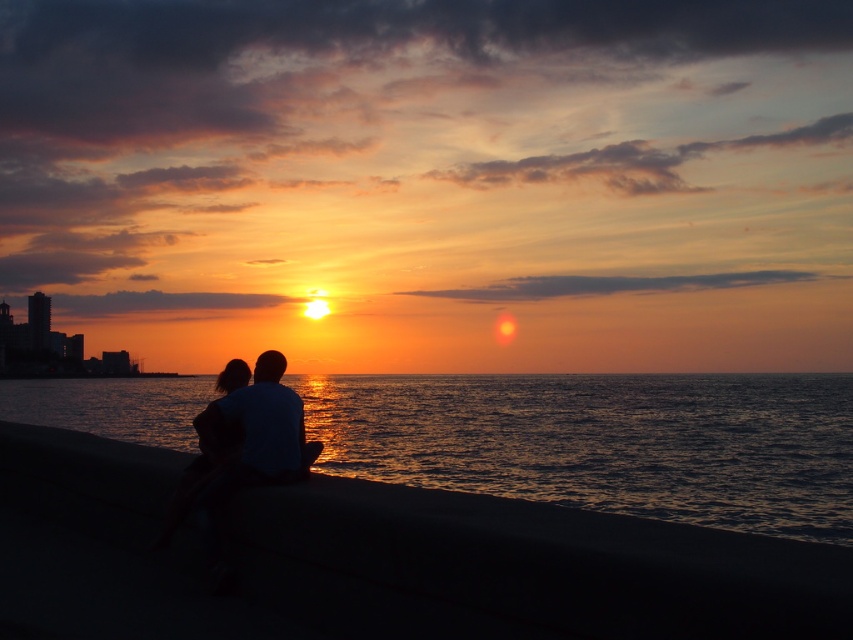
Question: Which of the following is the farthest from the observer?

Choices:
 (A) (762, 424)
 (B) (602, 528)

Answer: (A)

Question: Is smooth concrete wall at lower center above shiny dark water at lower center?

Choices:
 (A) no
 (B) yes

Answer: (B)

Question: Is smooth concrete wall at lower center smaller than shiny dark water at lower center?

Choices:
 (A) no
 (B) yes

Answer: (B)

Question: Which of the following is the closest to the observer?

Choices:
 (A) smooth concrete wall at lower center
 (B) shiny dark water at lower center

Answer: (A)

Question: Is smooth concrete wall at lower center thinner than shiny dark water at lower center?

Choices:
 (A) yes
 (B) no

Answer: (A)